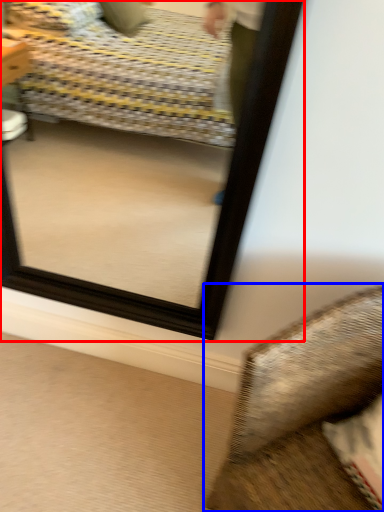
Question: Which of the following is the farthest to the observer, mirror (highlighted by a red box) or furniture (highlighted by a blue box)?

Choices:
 (A) mirror
 (B) furniture

Answer: (A)